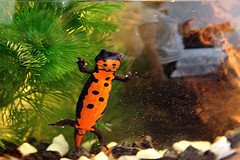
Identify the location of plant. Image resolution: width=240 pixels, height=160 pixels. tap(25, 45).